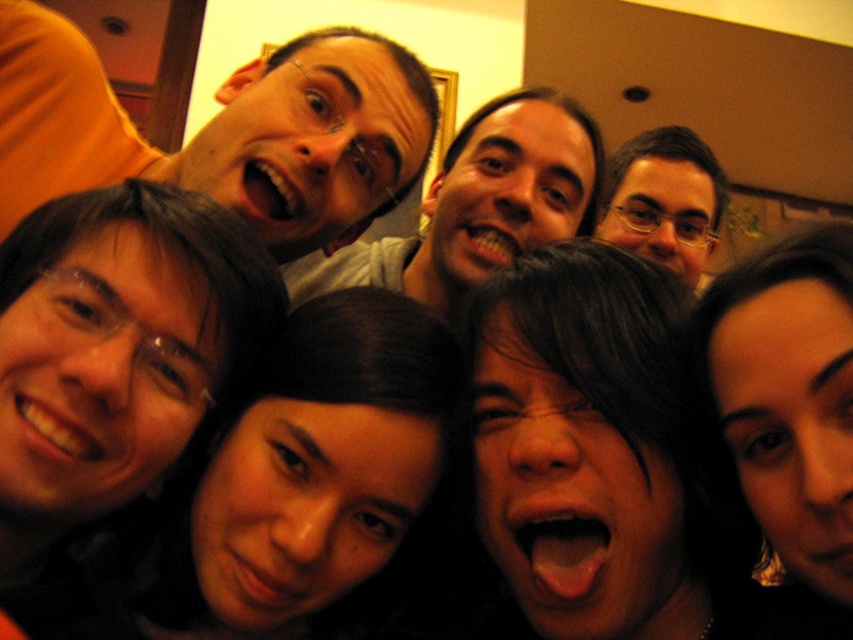
You are a photographer trying to adjust the lighting for a portrait. You notice the matte black hair at upper left and the matte gray shirt at center in the frame. Which object should you focus on first if you want to ensure proper exposure for the subject closest to the camera?

The matte black hair at upper left is above the matte gray shirt at center, so it is closer to the camera. Therefore, you should focus on the matte black hair at upper left first to ensure proper exposure for the subject closest to the camera.

You are a photographer trying to adjust the lighting for a group photo. You notice two items in the frame that might cast shadows. The matte black hair at upper left and the matte black glasses at upper center. Which of these two items has a wider width in the image?

The matte black hair at upper left has a larger width than the matte black glasses at upper center.

You are taking a photo with a camera that has a minimum focus distance of 1 meter. The point at coordinates point (99, 132) is part of the scene. Can the camera focus on that point?

The point (99, 132) is 97.84 centimeters from the camera, which is less than the minimum focus distance of 1 meter. Therefore, the camera cannot focus on that point.